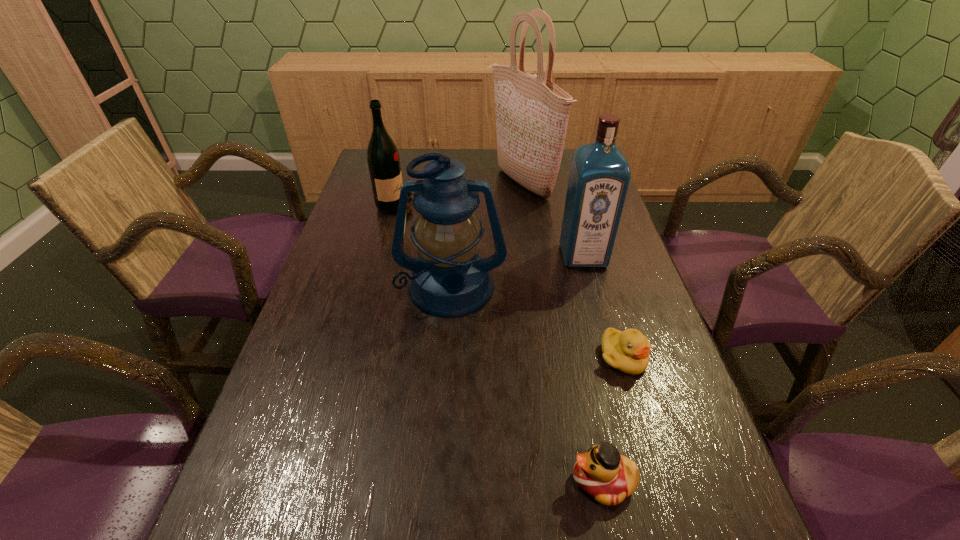
Find the location of a particular element. This screenshot has width=960, height=540. free point between the lantern and the duckling is located at coordinates (538, 322).

Where is `vacant space in between the second nearest object and the nearest object`? vacant space in between the second nearest object and the nearest object is located at coordinates (613, 419).

Locate an element on the screen. The height and width of the screenshot is (540, 960). object identified as the third closest to the lantern is located at coordinates (383, 159).

Find the location of a particular element. object that is the fourth closest to the nearest object is located at coordinates [x=532, y=113].

Find the location of `free space that satisfies the following two spatial constraints: 1. on the flat label side of the liquor; 2. on the face of the nearest object`. free space that satisfies the following two spatial constraints: 1. on the flat label side of the liquor; 2. on the face of the nearest object is located at coordinates coord(644,481).